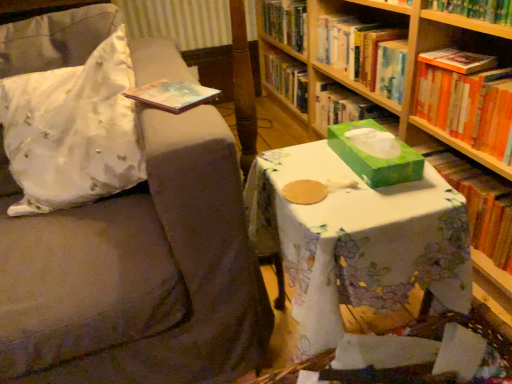
Identify the location of blank space to the left of green paper tissue box at center. (307, 171).